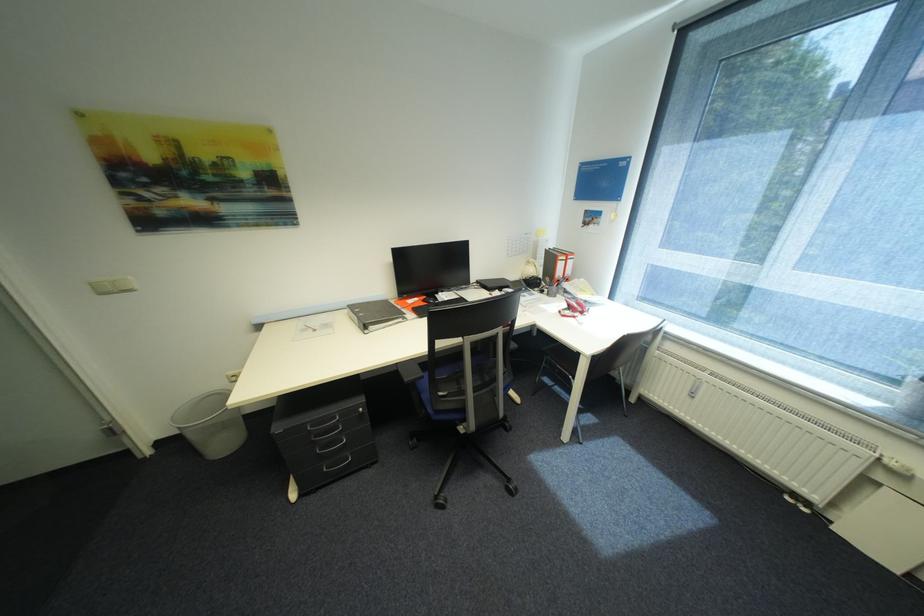
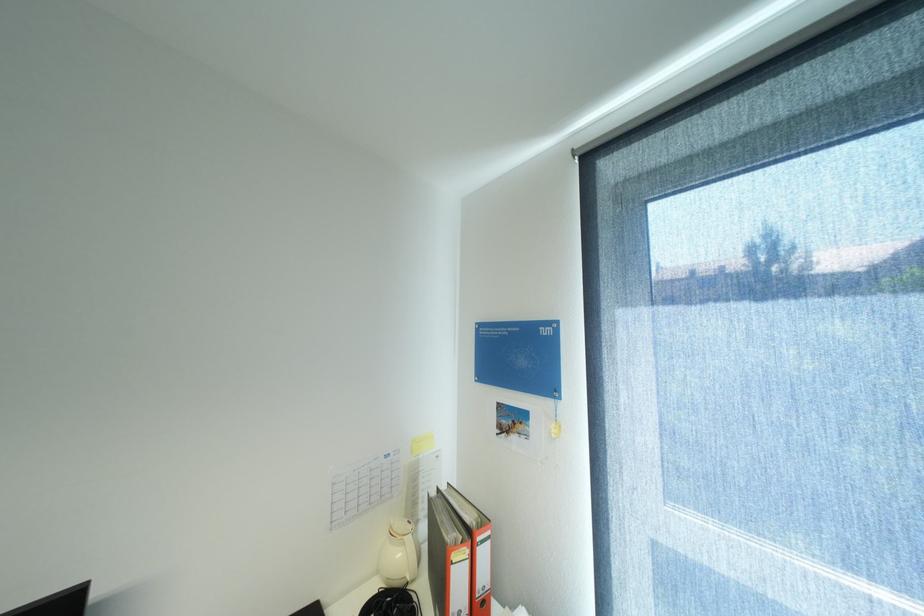
Find the pixel in the second image that matches [540,270] in the first image.

(407, 554)